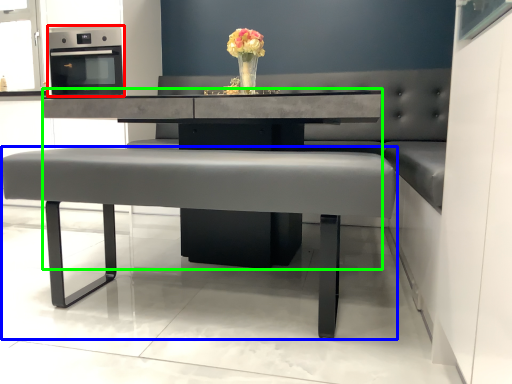
Question: Based on their relative distances, which object is nearer to appliance (highlighted by a red box)? Choose from table (highlighted by a blue box) and round table (highlighted by a green box).

Choices:
 (A) table
 (B) round table

Answer: (B)